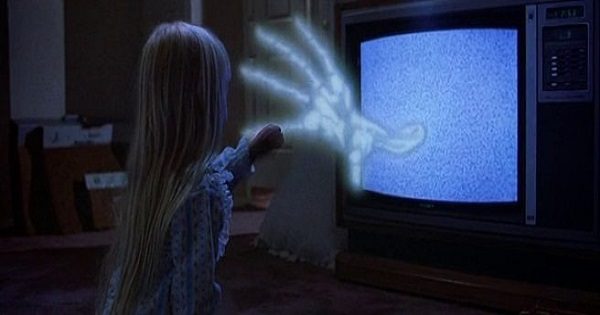
Find the location of `white wall`. white wall is located at coordinates (64, 72).